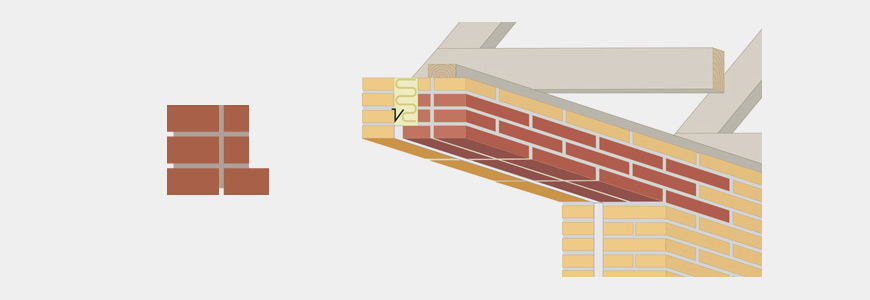
Identify the location of left beam. This screenshot has width=870, height=300. (706, 117).